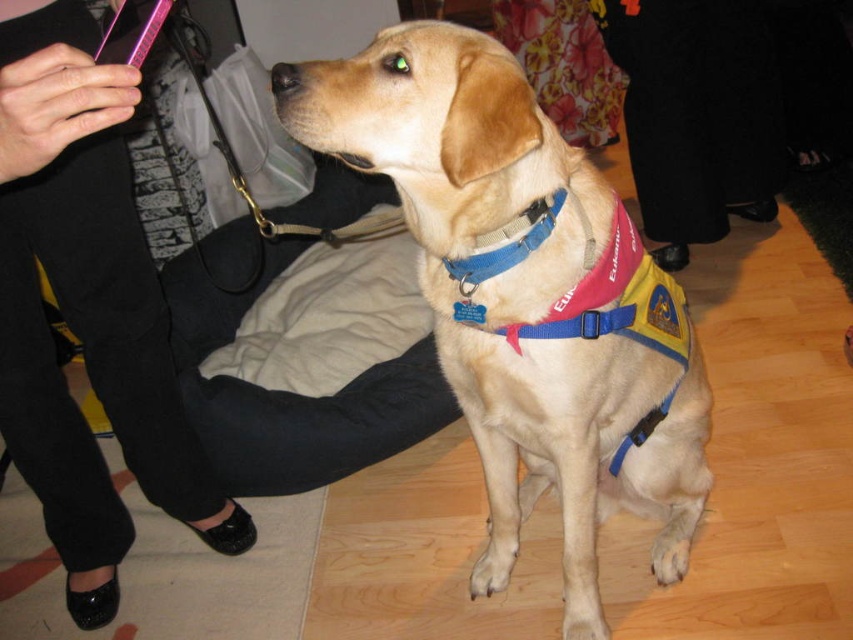
Can you confirm if golden fur vest at center is positioned above black fabric pants at lower center?

No.

Image resolution: width=853 pixels, height=640 pixels. I want to click on golden fur vest at center, so click(x=521, y=294).

Is point (53, 280) positioned after point (741, 212)?

No, it is not.

Is black fabric pants at lower left thinner than black fabric pants at lower center?

Correct, black fabric pants at lower left's width is less than black fabric pants at lower center's.

Is point (158, 468) in front of point (720, 140)?

That is True.

Where is `black fabric pants at lower left`? black fabric pants at lower left is located at coordinates (86, 308).

Which is in front, point (392, 26) or point (105, 515)?

Point (392, 26) is in front.

Does point (323, 131) come farther from viewer compared to point (93, 253)?

No, it is not.

Find the location of `golden fur vest at center`. golden fur vest at center is located at coordinates (521, 294).